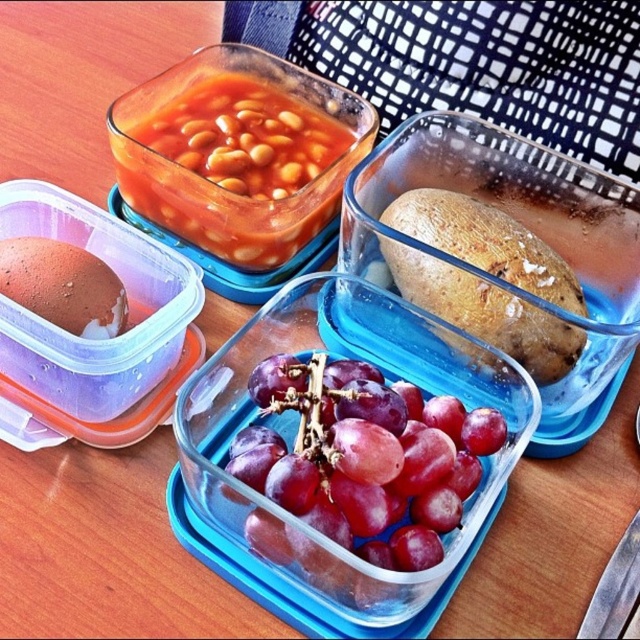
Between shiny purple grapes at center and brown matte potato at center, which one has more height?

brown matte potato at center is taller.

Is point (323, 472) in front of point (460, 218)?

Yes, point (323, 472) is in front of point (460, 218).

Locate an element on the screen. shiny purple grapes at center is located at coordinates tap(365, 458).

Does brown matte potato at center have a lesser width compared to brown matte egg at left?

Incorrect, brown matte potato at center's width is not less than brown matte egg at left's.

Can you confirm if brown matte potato at center is positioned below brown matte egg at left?

Incorrect, brown matte potato at center is not positioned below brown matte egg at left.

Between point (484, 230) and point (97, 289), which one is positioned behind?

The point (484, 230) is behind.

Where is `brown matte potato at center`? This screenshot has height=640, width=640. brown matte potato at center is located at coordinates [x=484, y=310].

Is shiny purple grapes at center bigger than translucent glass beans at upper center?

No.

Consider the image. Is shiny purple grapes at center smaller than translucent glass beans at upper center?

Yes.

Between point (454, 460) and point (234, 77), which one is positioned behind?

The point (234, 77) is behind.

Locate an element on the screen. shiny purple grapes at center is located at coordinates (365, 458).